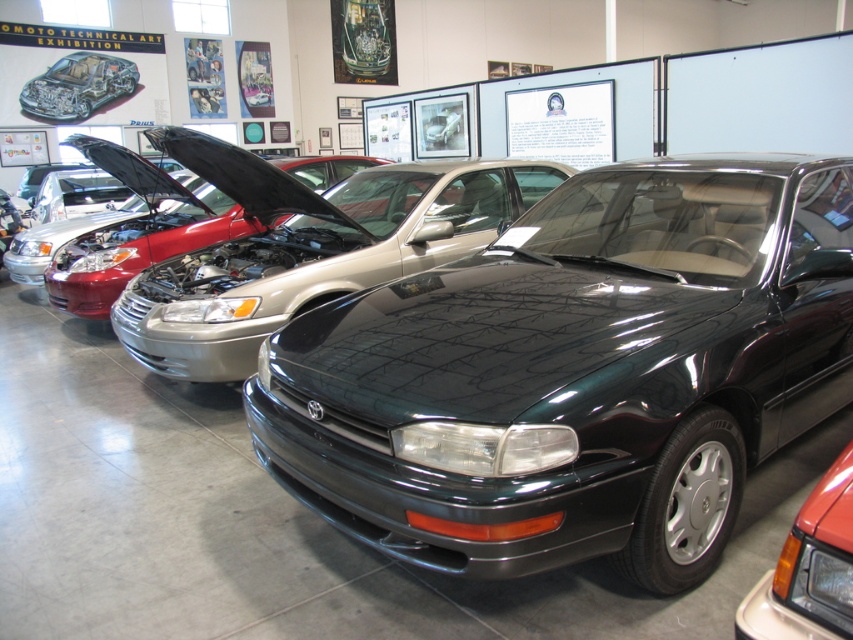
You are a photographer planning to shoot a series of car advertisements. You have a limited space in your studio and need to know the height difference between the glossy dark green car at center and the matte black car at center. Can you determine which one is taller?

The glossy dark green car at center is taller than the matte black car at center.

You are a photographer setting up a shoot in the automotive exhibition. You need to position a light to the left of the glossy dark green car at center and another light to the right of the matte black car at center. Will the two lights be placed in the same location?

The glossy dark green car at center is to the right of the matte black car at center. Therefore, placing a light to the left of the glossy dark green car at center and to the right of the matte black car at center would result in the two lights being in the same location.